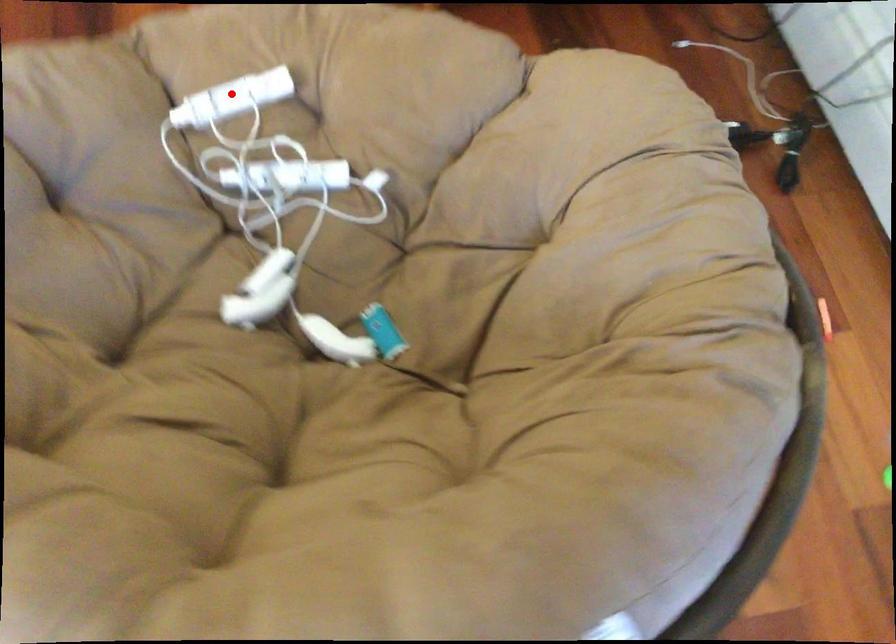
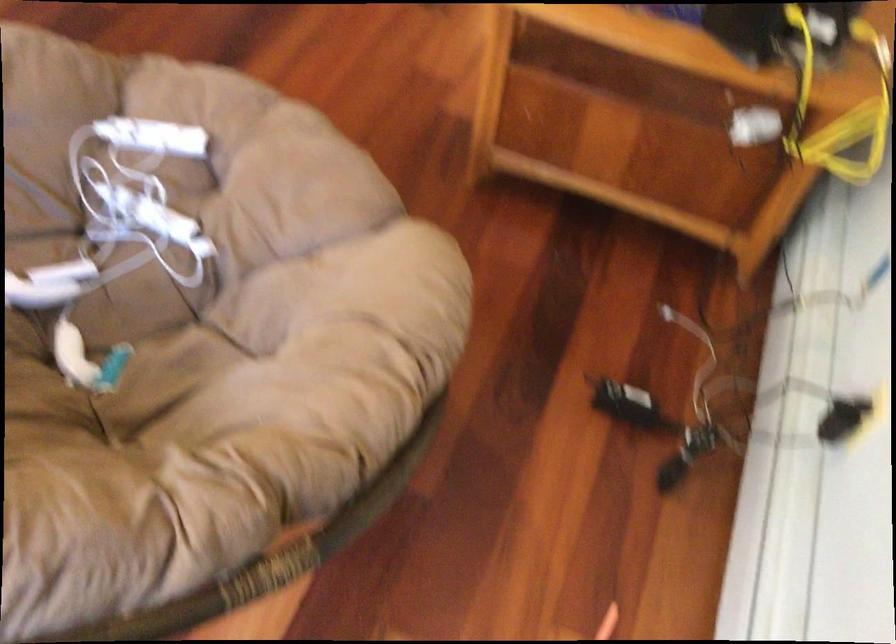
Question: I am providing you with two images of the same scene from different viewpoints. Given a red point in image1, look at the same physical point in image2. Is it:

Choices:
 (A) Closer to the viewpoint
 (B) Farther from the viewpoint

Answer: (B)